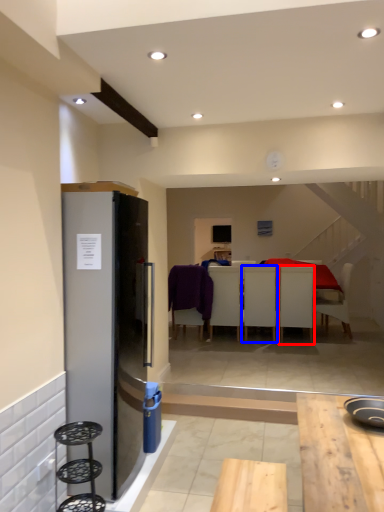
Question: Which point is closer to the camera, chair (highlighted by a red box) or chair (highlighted by a blue box)?

Choices:
 (A) chair
 (B) chair

Answer: (A)